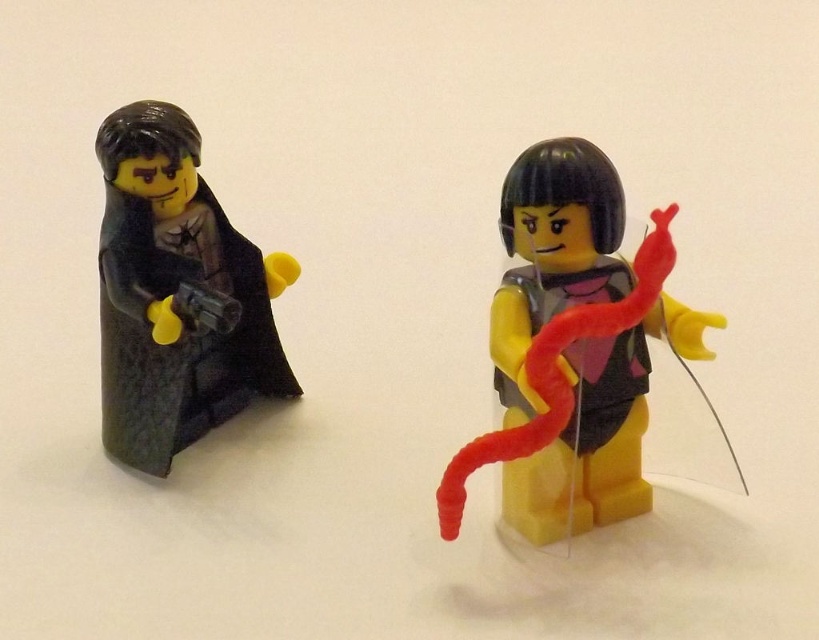
Question: Is matte black minifigure at center below matte black cape at left?

Choices:
 (A) yes
 (B) no

Answer: (A)

Question: Is matte black minifigure at center smaller than matte black cape at left?

Choices:
 (A) yes
 (B) no

Answer: (A)

Question: Can you confirm if matte black minifigure at center is positioned above matte black cape at left?

Choices:
 (A) no
 (B) yes

Answer: (A)

Question: Which object is farther from the camera taking this photo?

Choices:
 (A) matte black minifigure at center
 (B) matte black cape at left

Answer: (B)

Question: Among these points, which one is farthest from the camera?

Choices:
 (A) (177, 448)
 (B) (519, 426)

Answer: (A)

Question: Which of the following is the closest to the observer?

Choices:
 (A) matte black minifigure at center
 (B) matte black cape at left

Answer: (A)